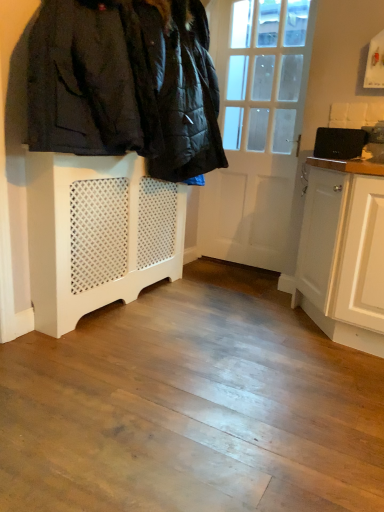
Question: Does white painted wood radiator at lower left come behind white lattice radiator at left?

Choices:
 (A) no
 (B) yes

Answer: (B)

Question: From a real-world perspective, is white painted wood radiator at lower left positioned over white lattice radiator at left based on gravity?

Choices:
 (A) yes
 (B) no

Answer: (B)

Question: From a real-world perspective, is white painted wood radiator at lower left located beneath white lattice radiator at left?

Choices:
 (A) no
 (B) yes

Answer: (B)

Question: Does white painted wood radiator at lower left have a lesser width compared to white lattice radiator at left?

Choices:
 (A) yes
 (B) no

Answer: (A)

Question: From the image's perspective, is white painted wood radiator at lower left under white lattice radiator at left?

Choices:
 (A) no
 (B) yes

Answer: (B)

Question: Relative to black matte laptop at upper right, is white painted wood radiator at lower left in front or behind?

Choices:
 (A) front
 (B) behind

Answer: (A)

Question: From a real-world perspective, relative to black matte laptop at upper right, is white painted wood radiator at lower left vertically above or below?

Choices:
 (A) above
 (B) below

Answer: (B)

Question: Based on their sizes in the image, would you say white painted wood radiator at lower left is bigger or smaller than black matte laptop at upper right?

Choices:
 (A) small
 (B) big

Answer: (B)

Question: Would you say white painted wood radiator at lower left is inside or outside black matte laptop at upper right?

Choices:
 (A) outside
 (B) inside

Answer: (A)

Question: Is white lattice radiator at left situated inside white wooden door at center or outside?

Choices:
 (A) outside
 (B) inside

Answer: (A)

Question: Relative to white wooden door at center, is white lattice radiator at left in front or behind?

Choices:
 (A) front
 (B) behind

Answer: (A)

Question: Is white lattice radiator at left wider or thinner than white wooden door at center?

Choices:
 (A) thin
 (B) wide

Answer: (B)

Question: Is point (72, 64) closer or farther from the camera than point (220, 176)?

Choices:
 (A) farther
 (B) closer

Answer: (B)

Question: Based on their sizes in the image, would you say white wooden door at center is bigger or smaller than white lattice radiator at left?

Choices:
 (A) big
 (B) small

Answer: (B)

Question: From a real-world perspective, relative to white lattice radiator at left, is white wooden door at center vertically above or below?

Choices:
 (A) above
 (B) below

Answer: (B)